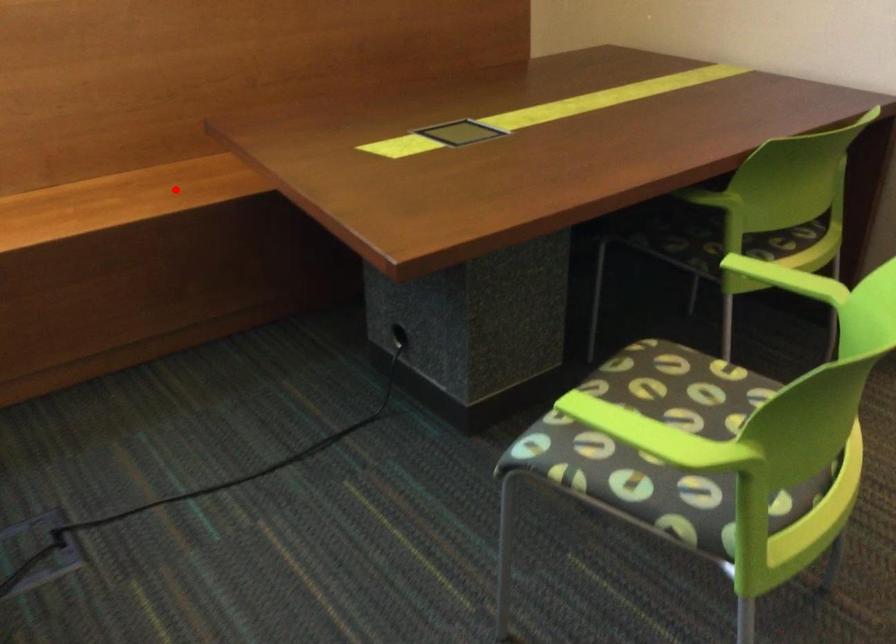
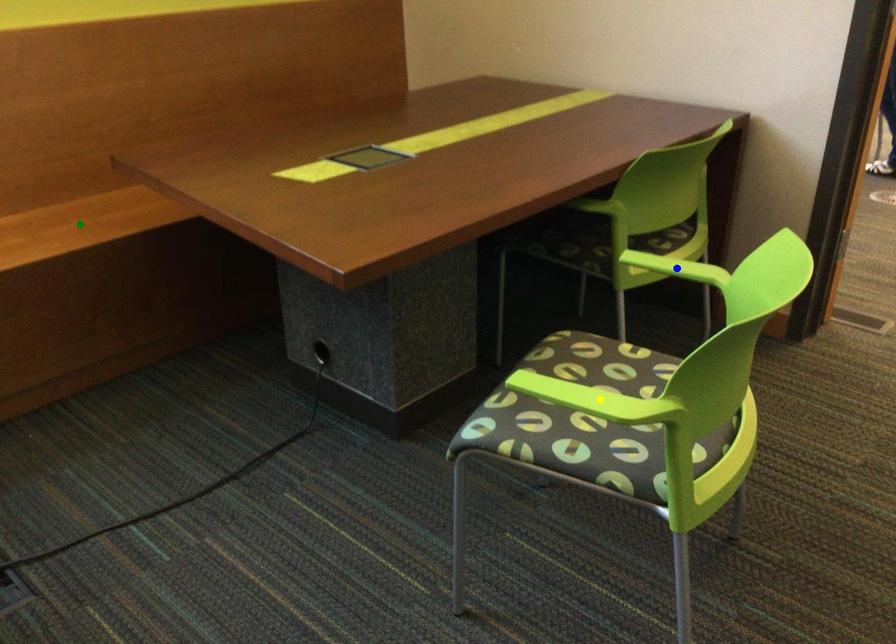
Question: I am providing you with two images of the same scene from different viewpoints. A red point is marked on the first image. You are given multiple points on the second image. Which spot in image 2 lines up with the point in image 1?

Choices:
 (A) green point
 (B) yellow point
 (C) blue point

Answer: (A)